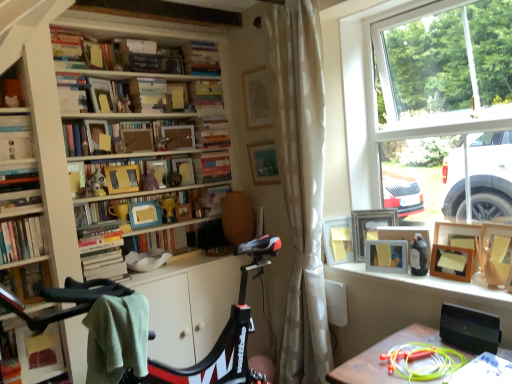
Question: Is white dotted fabric curtain at center wider or thinner than green fabric desk at lower right?

Choices:
 (A) thin
 (B) wide

Answer: (A)

Question: Is white dotted fabric curtain at center in front of or behind green fabric desk at lower right in the image?

Choices:
 (A) front
 (B) behind

Answer: (B)

Question: Estimate the real-world distances between objects in this image. Which object is closer to the hardcover book at upper left, the fifth book in the top-to-bottom sequence?

Choices:
 (A) matte wooden frame at center, which is counted as the fifth book, starting from the bottom
 (B) wooden frame at upper center, which ranks as the 10th book in bottom-to-top order
 (C) yellow matte picture frame at window, which ranks as the third picture frame in right-to-left order
 (D) wooden picture frame at window, positioned as the 5th picture frame in left-to-right order
 (E) hardcover book at center, acting as the third book starting from the bottom

Answer: (B)

Question: Which is nearer to the hardcover book at center, the 6th book from the top?

Choices:
 (A) hardcover book at center, which ranks as the first book in bottom-to-top order
 (B) hardcover book at upper center, marked as the first book in a top-to-bottom arrangement
 (C) green fabric desk at lower right
 (D) hardcover book at center, the 2th book positioned from the top
 (E) wooden frame at center, placed as the seventh book when sorted from top to bottom

Answer: (E)